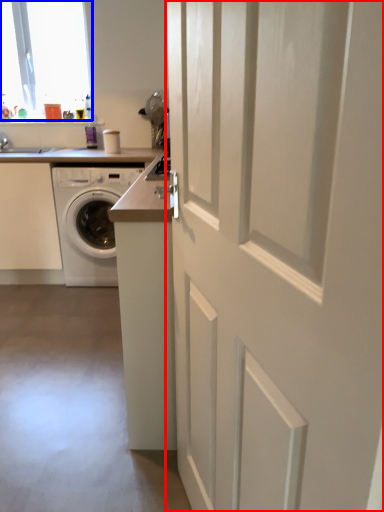
Question: Which point is further to the camera, door (highlighted by a red box) or window (highlighted by a blue box)?

Choices:
 (A) door
 (B) window

Answer: (B)